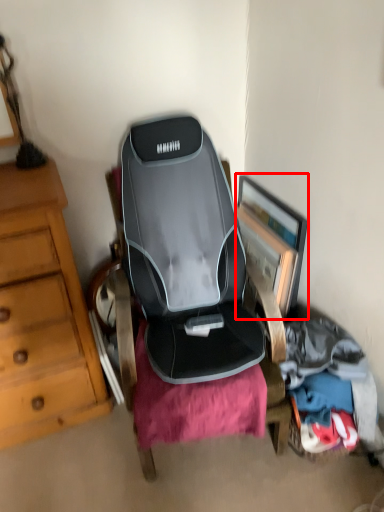
Question: From the image, what is the correct spatial relationship of picture frame (annotated by the red box) in relation to clothing?

Choices:
 (A) right
 (B) left

Answer: (B)